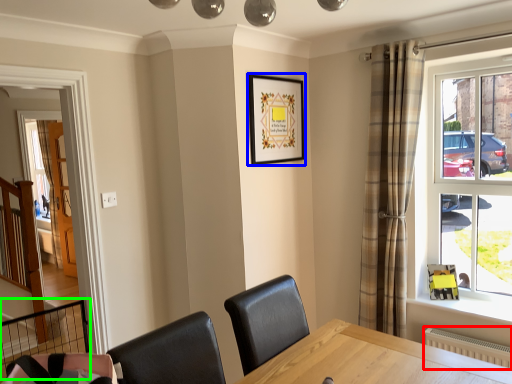
Question: Which object is positioned closest to radiator (highlighted by a red box)? Select from picture frame (highlighted by a blue box) and balustrade (highlighted by a green box).

Choices:
 (A) picture frame
 (B) balustrade

Answer: (A)